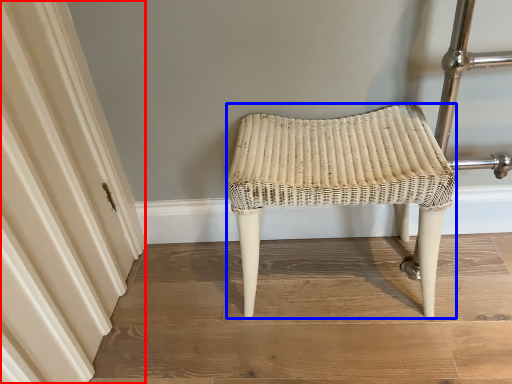
Question: Which of the following is the closest to the observer, curtain (highlighted by a red box) or stool (highlighted by a blue box)?

Choices:
 (A) curtain
 (B) stool

Answer: (A)